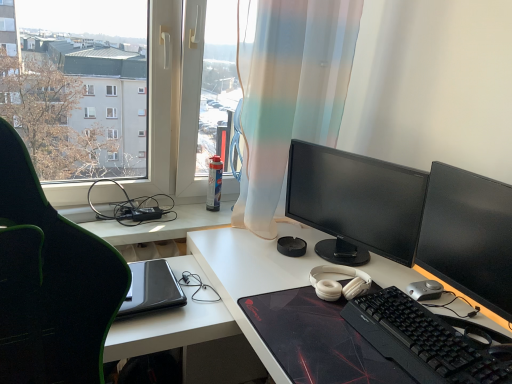
Locate an element on the screen. Image resolution: width=512 pixels, height=384 pixels. blank area beneath black textured mousepad at center (from a real-world perspective) is located at coordinates (329, 339).